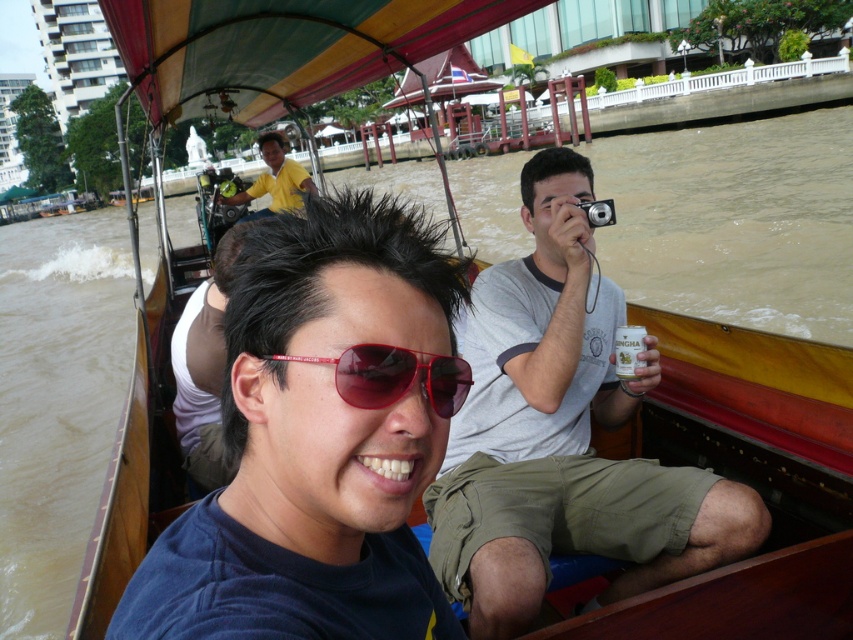
Does gray cotton t-shirt at center have a lesser width compared to red matte sunglasses at center?

In fact, gray cotton t-shirt at center might be wider than red matte sunglasses at center.

Is gray cotton t-shirt at center to the left of red matte sunglasses at center from the viewer's perspective?

No, gray cotton t-shirt at center is not to the left of red matte sunglasses at center.

Is point (564, 369) more distant than point (433, 358)?

That is True.

Where is `gray cotton t-shirt at center`? gray cotton t-shirt at center is located at coordinates (561, 435).

Is gray cotton t-shirt at center closer to the viewer compared to yellow shirt at center?

Yes.

Does gray cotton t-shirt at center have a lesser width compared to yellow shirt at center?

Yes, gray cotton t-shirt at center is thinner than yellow shirt at center.

At what (x,y) coordinates should I click in order to perform the action: click on gray cotton t-shirt at center. Please return your answer as a coordinate pair (x, y). Looking at the image, I should click on (561, 435).

Which is more to the right, matte black sunglasses at center or gray cotton t-shirt at center?

From the viewer's perspective, gray cotton t-shirt at center appears more on the right side.

Which is below, matte black sunglasses at center or gray cotton t-shirt at center?

Positioned lower is gray cotton t-shirt at center.

Is point (181, 540) closer to viewer compared to point (555, 355)?

That is True.

Locate an element on the screen. This screenshot has height=640, width=853. matte black sunglasses at center is located at coordinates (318, 438).